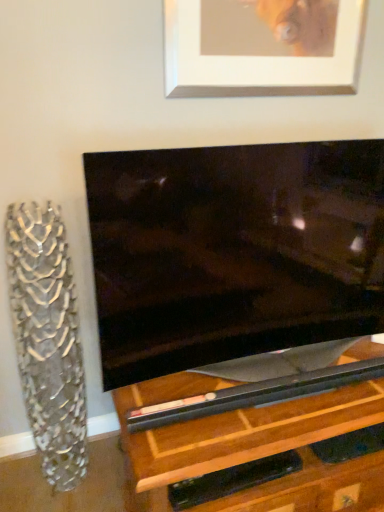
What do you see at coordinates (47, 339) in the screenshot?
I see `clear glass vase at left` at bounding box center [47, 339].

In order to face clear glass vase at left, should I rotate leftwards or rightwards?

→ Rotate your view left by about 18.144°.

Where is `clear glass vase at left`? This screenshot has height=512, width=384. clear glass vase at left is located at coordinates (47, 339).

This screenshot has height=512, width=384. What do you see at coordinates (262, 47) in the screenshot?
I see `silver/metallic picture frame at upper center` at bounding box center [262, 47].

What is the approximate height of silver/metallic picture frame at upper center?

It is 14.83 inches.

The image size is (384, 512). I want to click on silver/metallic picture frame at upper center, so click(262, 47).

The width and height of the screenshot is (384, 512). In order to click on clear glass vase at left in this screenshot , I will do `click(47, 339)`.

Looking at this image, which is more to the right, clear glass vase at left or silver/metallic picture frame at upper center?

silver/metallic picture frame at upper center.

Does clear glass vase at left come behind silver/metallic picture frame at upper center?

No, clear glass vase at left is closer to the camera.

Does point (39, 284) appear closer or farther from the camera than point (225, 93)?

Point (39, 284) appears to be closer to the viewer than point (225, 93).

From the picture: From the image's perspective, is clear glass vase at left on silver/metallic picture frame at upper center?

Actually, clear glass vase at left appears below silver/metallic picture frame at upper center in the image.

From a real-world perspective, between clear glass vase at left and silver/metallic picture frame at upper center, who is vertically higher?

silver/metallic picture frame at upper center is physically above.

Which object is thinner, clear glass vase at left or silver/metallic picture frame at upper center?

silver/metallic picture frame at upper center is thinner.

Which of these two, clear glass vase at left or silver/metallic picture frame at upper center, stands taller?

Standing taller between the two is clear glass vase at left.

Who is bigger, clear glass vase at left or silver/metallic picture frame at upper center?

clear glass vase at left is bigger.

Is clear glass vase at left situated inside silver/metallic picture frame at upper center or outside?

clear glass vase at left is located beyond the bounds of silver/metallic picture frame at upper center.

Is clear glass vase at left touching silver/metallic picture frame at upper center?

No, clear glass vase at left is not in contact with silver/metallic picture frame at upper center.

In the scene shown: Is clear glass vase at left turned away from silver/metallic picture frame at upper center?

clear glass vase at left is not turned away from silver/metallic picture frame at upper center.

Identify the location of picture frame above the clear glass vase at left (from the image's perspective). (262, 47).

In the scene shown: Does silver/metallic picture frame at upper center appear on the left side of clear glass vase at left?

Incorrect, silver/metallic picture frame at upper center is not on the left side of clear glass vase at left.

Which object is further away from the camera, silver/metallic picture frame at upper center or clear glass vase at left?

silver/metallic picture frame at upper center is more distant.

Is point (203, 61) behind point (67, 403)?

No, (203, 61) is closer to viewer.

From the image's perspective, which is above, silver/metallic picture frame at upper center or clear glass vase at left?

From the image's view, silver/metallic picture frame at upper center is above.

From a real-world perspective, is silver/metallic picture frame at upper center on top of clear glass vase at left?

Yes, from a real-world perspective, silver/metallic picture frame at upper center is on top of clear glass vase at left.

Between silver/metallic picture frame at upper center and clear glass vase at left, which one has smaller width?

silver/metallic picture frame at upper center is thinner.

Considering the relative sizes of silver/metallic picture frame at upper center and clear glass vase at left in the image provided, is silver/metallic picture frame at upper center shorter than clear glass vase at left?

Indeed, silver/metallic picture frame at upper center has a lesser height compared to clear glass vase at left.

Can you confirm if silver/metallic picture frame at upper center is smaller than clear glass vase at left?

Yes, silver/metallic picture frame at upper center is smaller than clear glass vase at left.

Can we say silver/metallic picture frame at upper center lies outside clear glass vase at left?

Yes, silver/metallic picture frame at upper center is not within clear glass vase at left.

Consider the image. Are silver/metallic picture frame at upper center and clear glass vase at left making contact?

No, silver/metallic picture frame at upper center is not next to clear glass vase at left.

Is silver/metallic picture frame at upper center oriented away from clear glass vase at left?

silver/metallic picture frame at upper center is not turned away from clear glass vase at left.

Can you tell me how much silver/metallic picture frame at upper center and clear glass vase at left differ in facing direction?

There is a 1.88-degree angle between the facing directions of silver/metallic picture frame at upper center and clear glass vase at left.

How far apart are silver/metallic picture frame at upper center and clear glass vase at left?

A distance of 1.03 meters exists between silver/metallic picture frame at upper center and clear glass vase at left.

You are a GUI agent. You are given a task and a screenshot of the screen. Output one action in this format:
    pyautogui.click(x=<x>, y=<y>)
    Task: Click on the picture frame above the clear glass vase at left (from the image's perspective)
    The height and width of the screenshot is (512, 384).
    Given the screenshot: What is the action you would take?
    pyautogui.click(x=262, y=47)

Locate an element on the screen. Image resolution: width=384 pixels, height=512 pixels. glass vase that is under the silver/metallic picture frame at upper center (from a real-world perspective) is located at coordinates (47, 339).

The image size is (384, 512). What are the coordinates of `picture frame on the right of clear glass vase at left` in the screenshot? It's located at (262, 47).